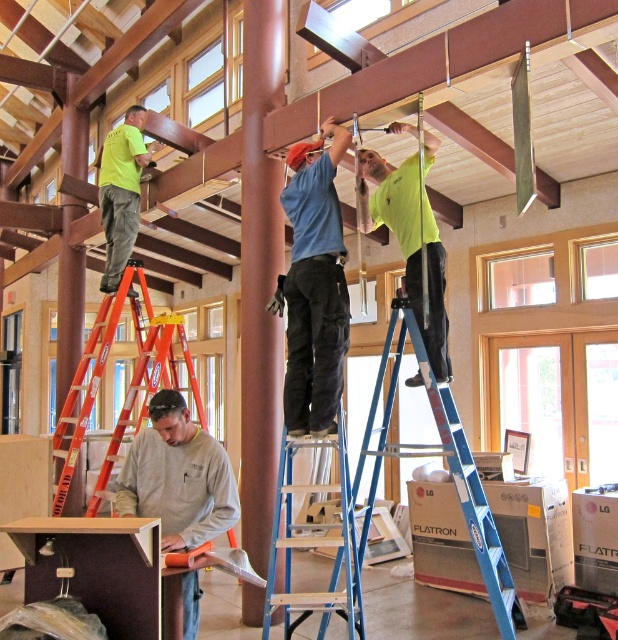
Can you confirm if gray matte shirt at center is bigger than neon green shirt at upper left?

No, gray matte shirt at center is not bigger than neon green shirt at upper left.

Which is above, gray matte shirt at center or neon green shirt at upper left?

neon green shirt at upper left is above.

Locate an element on the screen. The width and height of the screenshot is (618, 640). gray matte shirt at center is located at coordinates (177, 476).

Find the location of a particular element. The image size is (618, 640). gray matte shirt at center is located at coordinates (177, 476).

Is gray matte shirt at center shorter than blue aluminum ladder at center?

Correct, gray matte shirt at center is not as tall as blue aluminum ladder at center.

Between gray matte shirt at center and blue aluminum ladder at center, which one is positioned lower?

Positioned lower is blue aluminum ladder at center.

Who is more distant from viewer, (188,548) or (326,621)?

The point (326,621) is more distant.

This screenshot has width=618, height=640. Identify the location of gray matte shirt at center. (177, 476).

Does blue metallic ladder at center appear on the right side of bright yellow shirt at upper center?

Correct, you'll find blue metallic ladder at center to the right of bright yellow shirt at upper center.

Which is above, blue metallic ladder at center or bright yellow shirt at upper center?

bright yellow shirt at upper center

This screenshot has height=640, width=618. What do you see at coordinates (447, 465) in the screenshot?
I see `blue metallic ladder at center` at bounding box center [447, 465].

I want to click on blue metallic ladder at center, so click(x=447, y=465).